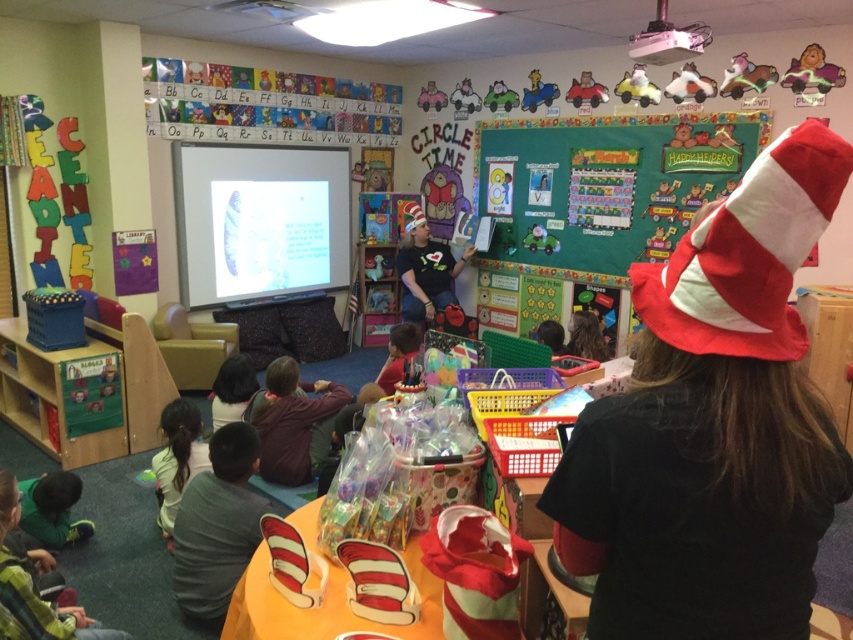
Question: Does plush red car at upper center appear on the right side of green plastic toy car at upper center?

Choices:
 (A) no
 (B) yes

Answer: (B)

Question: Estimate the real-world distances between objects in this image. Which object is farther from the red velvet hat at upper center?

Choices:
 (A) green matte bulletin board at upper center
 (B) plush red car at upper center

Answer: (B)

Question: Does dark brown hair at lower left appear over metallic blue car at upper center?

Choices:
 (A) no
 (B) yes

Answer: (A)

Question: Which of these objects is positioned farthest from the fluffy yellow plush at upper right?

Choices:
 (A) red velvet hat at upper center
 (B) plush toy car at upper center

Answer: (A)

Question: Is metallic blue car at upper center in front of green felt board at upper center?

Choices:
 (A) yes
 (B) no

Answer: (A)

Question: Based on their relative distances, which object is nearer to the green fabric pants at lower left?

Choices:
 (A) white plush toy at upper center
 (B) dark brown sweater at lower left
 (C) fluffy yellow plush at upper right

Answer: (B)